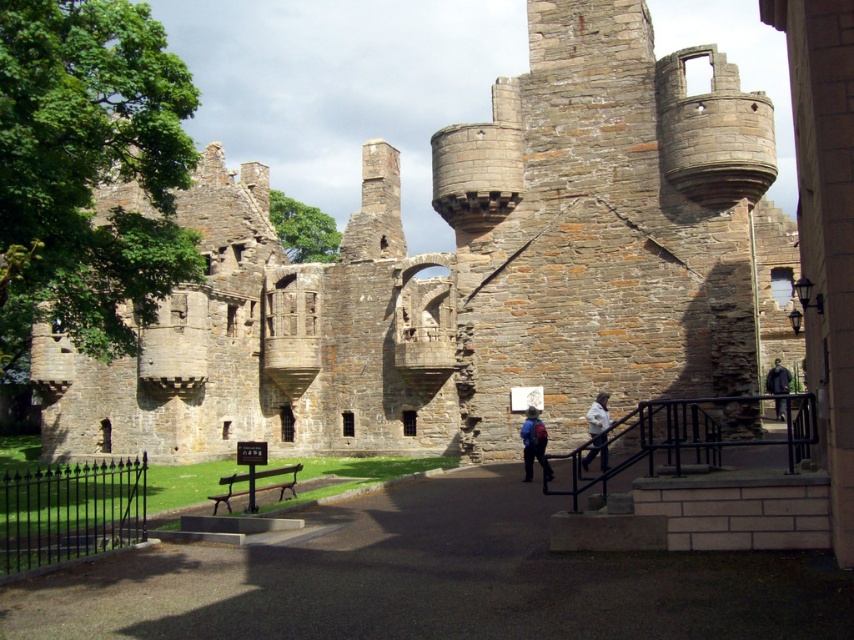
Can you confirm if brown stone castle at center is wider than white cotton jacket at lower center?

Correct, the width of brown stone castle at center exceeds that of white cotton jacket at lower center.

Does brown stone castle at center have a greater height compared to white cotton jacket at lower center?

Yes.

Where is `brown stone castle at center`? The height and width of the screenshot is (640, 854). brown stone castle at center is located at coordinates (472, 275).

Is brown stone castle at center behind dark blue fabric jacket at right?

Yes, it is behind dark blue fabric jacket at right.

Does brown stone castle at center have a lesser height compared to dark blue fabric jacket at right?

In fact, brown stone castle at center may be taller than dark blue fabric jacket at right.

This screenshot has width=854, height=640. Describe the element at coordinates (472, 275) in the screenshot. I see `brown stone castle at center` at that location.

Identify the location of brown stone castle at center. Image resolution: width=854 pixels, height=640 pixels. (472, 275).

Which is more to the left, blue backpack at center or dark blue fabric jacket at right?

blue backpack at center is more to the left.

What do you see at coordinates (534, 444) in the screenshot? I see `blue backpack at center` at bounding box center [534, 444].

Is point (535, 438) less distant than point (769, 384)?

That is True.

The width and height of the screenshot is (854, 640). What are the coordinates of `blue backpack at center` in the screenshot? It's located at (534, 444).